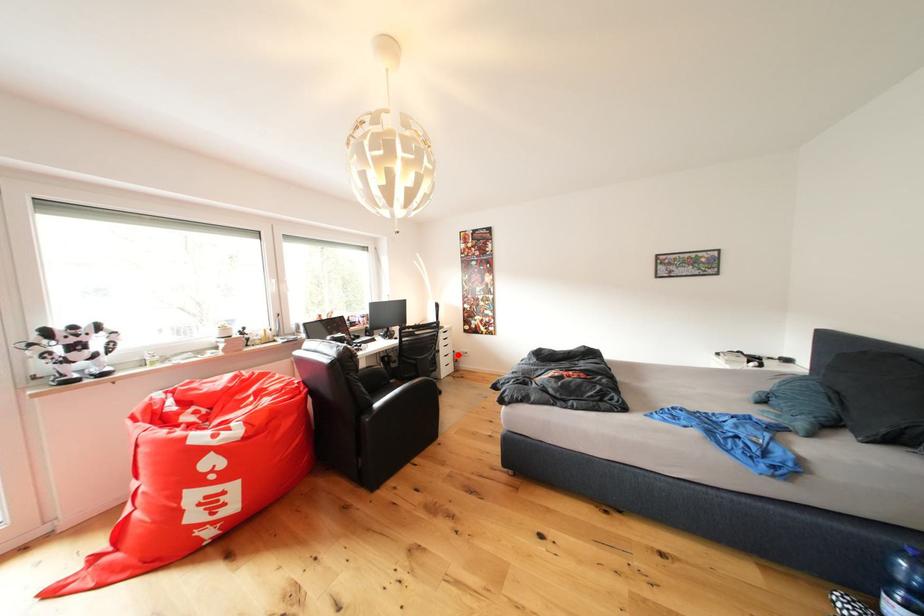
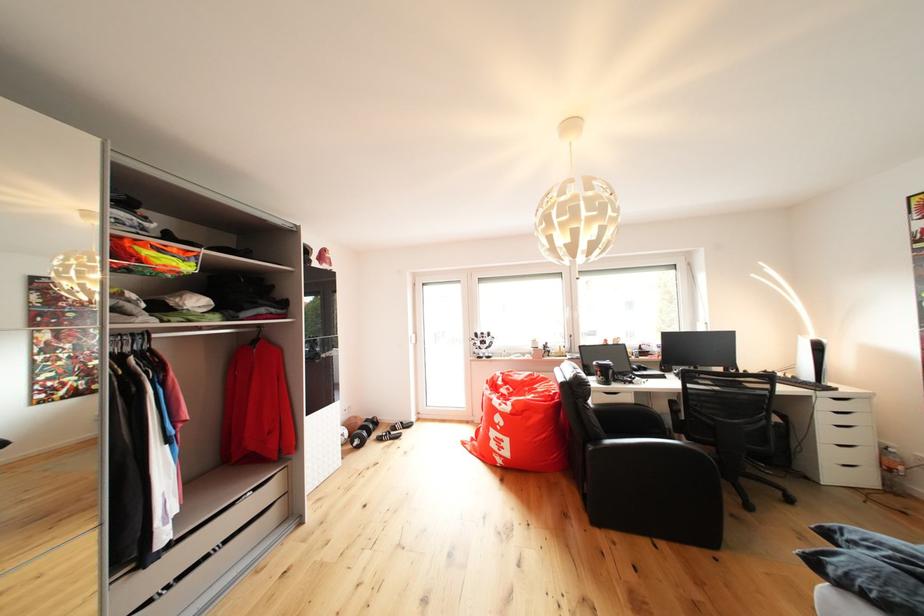
Where in the second image is the point corresponding to the highlighted location from the first image?

(869, 444)